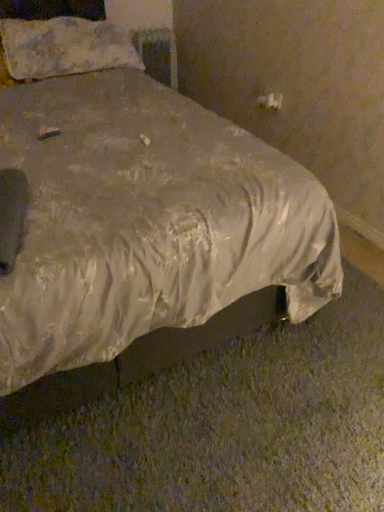
Question: Can you confirm if fluffy white pillow at upper left is shorter than metallic silver radiator at upper center?

Choices:
 (A) yes
 (B) no

Answer: (A)

Question: From the image's perspective, is fluffy white pillow at upper left over metallic silver radiator at upper center?

Choices:
 (A) yes
 (B) no

Answer: (B)

Question: Can you confirm if fluffy white pillow at upper left is smaller than metallic silver radiator at upper center?

Choices:
 (A) yes
 (B) no

Answer: (B)

Question: Can you confirm if fluffy white pillow at upper left is wider than metallic silver radiator at upper center?

Choices:
 (A) no
 (B) yes

Answer: (B)

Question: Does fluffy white pillow at upper left appear on the left side of metallic silver radiator at upper center?

Choices:
 (A) yes
 (B) no

Answer: (A)

Question: Is point (64, 24) closer or farther from the camera than point (92, 279)?

Choices:
 (A) closer
 (B) farther

Answer: (B)

Question: Relative to silvery satin bed at center, is fluffy white pillow at upper left in front or behind?

Choices:
 (A) front
 (B) behind

Answer: (B)

Question: From a real-world perspective, is fluffy white pillow at upper left positioned above or below silvery satin bed at center?

Choices:
 (A) above
 (B) below

Answer: (A)

Question: From the image's perspective, is fluffy white pillow at upper left above or below silvery satin bed at center?

Choices:
 (A) above
 (B) below

Answer: (A)

Question: In terms of size, does metallic silver radiator at upper center appear bigger or smaller than fluffy white pillow at upper left?

Choices:
 (A) small
 (B) big

Answer: (A)

Question: From their relative heights in the image, would you say metallic silver radiator at upper center is taller or shorter than fluffy white pillow at upper left?

Choices:
 (A) short
 (B) tall

Answer: (B)

Question: Is point (170, 33) positioned closer to the camera than point (56, 72)?

Choices:
 (A) farther
 (B) closer

Answer: (A)

Question: From a real-world perspective, relative to fluffy white pillow at upper left, is metallic silver radiator at upper center vertically above or below?

Choices:
 (A) above
 (B) below

Answer: (B)

Question: From the image's perspective, is fluffy white pillow at upper left positioned above or below metallic silver radiator at upper center?

Choices:
 (A) below
 (B) above

Answer: (A)

Question: Choose the correct answer: Is fluffy white pillow at upper left inside metallic silver radiator at upper center or outside it?

Choices:
 (A) outside
 (B) inside

Answer: (A)